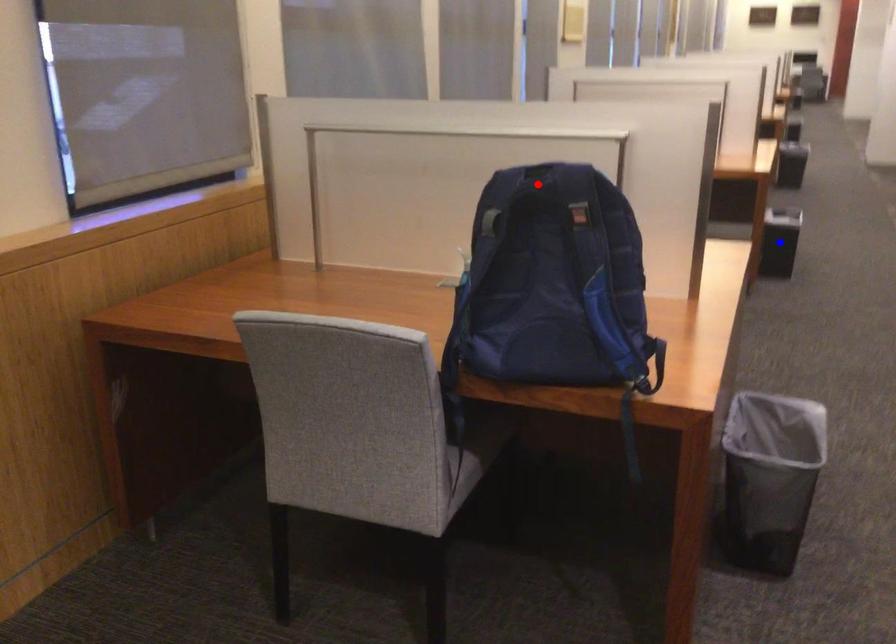
Question: Which of the two points in the image is closer to the camera?

Choices:
 (A) Blue point is closer.
 (B) Red point is closer.

Answer: (B)